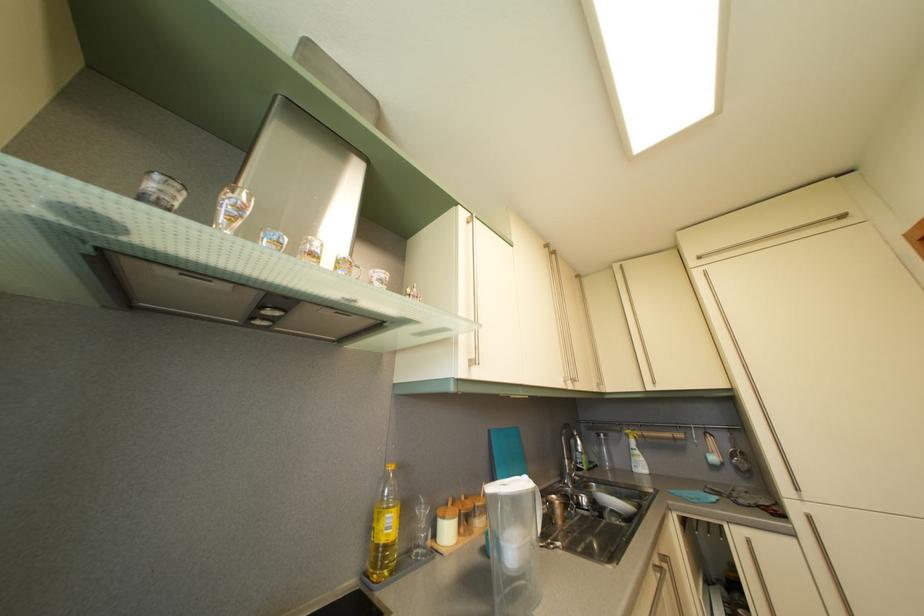
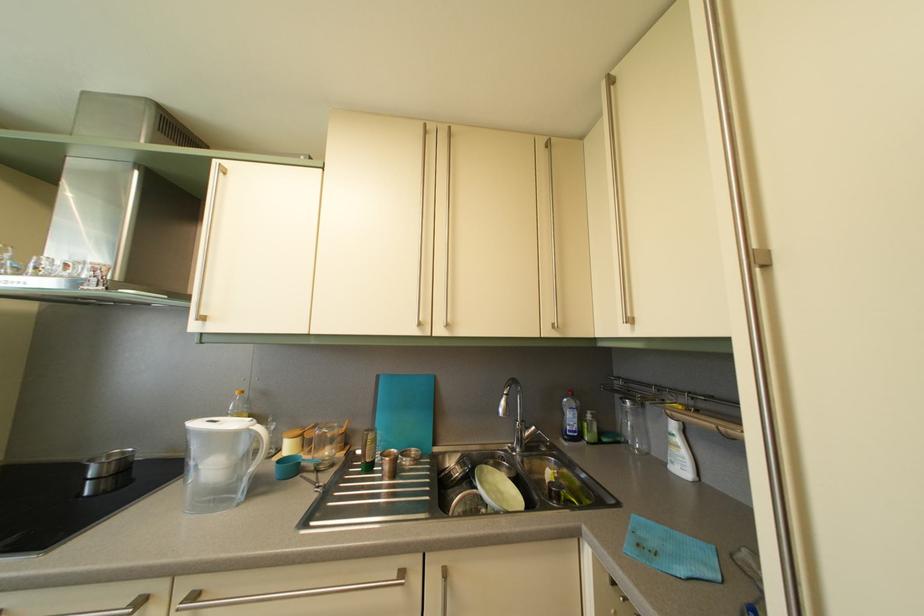
The point at (578, 394) is marked in the first image. Where is the corresponding point in the second image?

(447, 339)